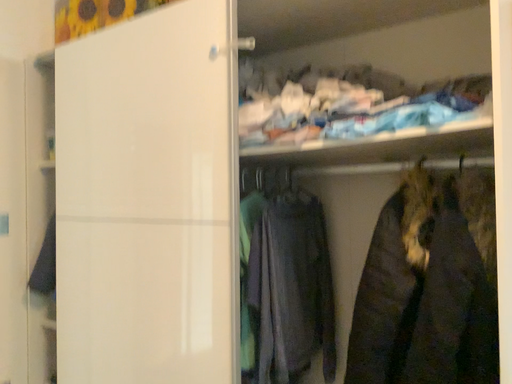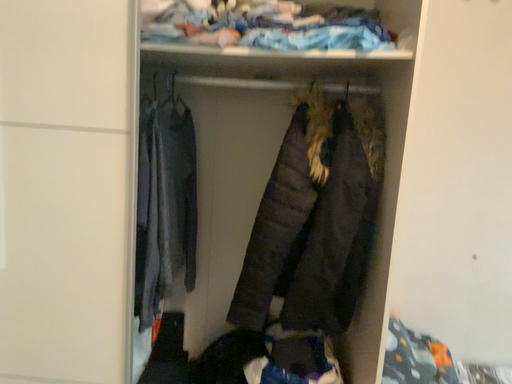
Question: How did the camera likely rotate when shooting the video?

Choices:
 (A) rotated downward
 (B) rotated upward

Answer: (A)